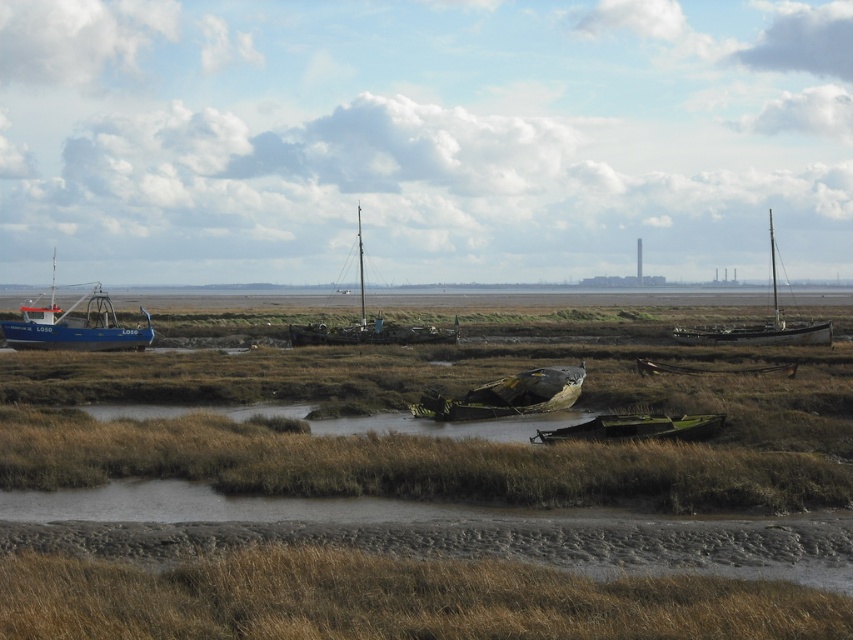
You are standing at the edge of the marshy area and see the blue painted wooden boat at left and the wooden sailboat at center. Which boat can you reach first if you walk straight ahead?

The blue painted wooden boat at left is closer to the viewer than the wooden sailboat at center, so you will reach the blue painted wooden boat at left first.

You are standing at the origin point of the image coordinate system. You want to walk to the brown dry grass at lower center. What are the coordinates you need to move to?

The coordinates you need to move to are approximately 0.939 in the x direction and 0.462 in the y direction.